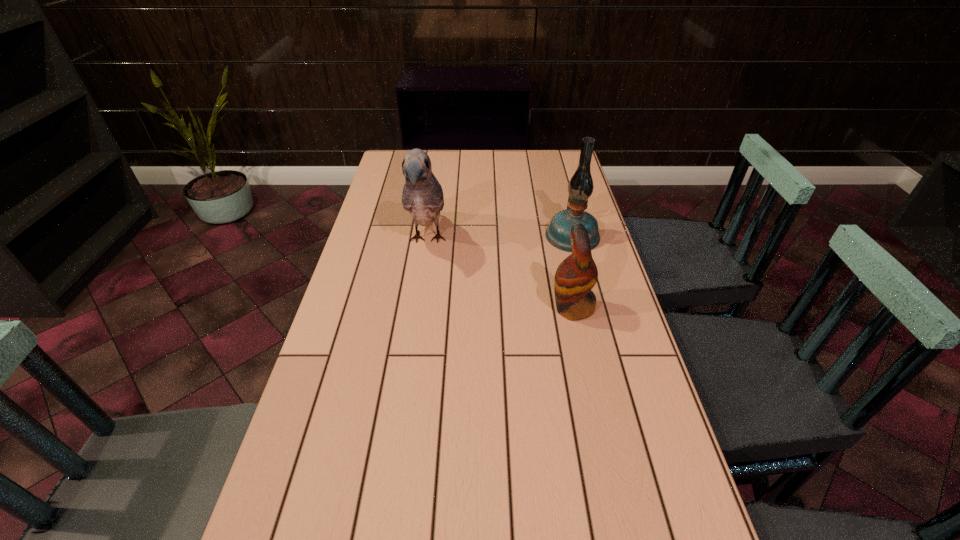
Where is `vacant space in between the shorter parrot and the leftmost object`? The width and height of the screenshot is (960, 540). vacant space in between the shorter parrot and the leftmost object is located at coordinates (500, 274).

The height and width of the screenshot is (540, 960). What are the coordinates of `object that is the closest one to the leftmost object` in the screenshot? It's located at (576, 275).

At what (x,y) coordinates should I click in order to perform the action: click on object that is the closest to the nearest object. Please return your answer as a coordinate pair (x, y). Looking at the image, I should click on (580, 187).